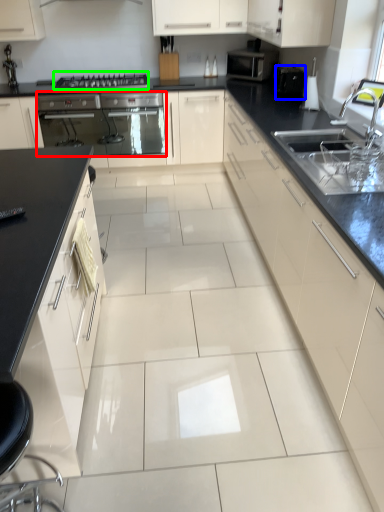
Question: Which object is positioned closest to home appliance (highlighted by a red box)? Select from appliance (highlighted by a blue box) and gas stove (highlighted by a green box).

Choices:
 (A) appliance
 (B) gas stove

Answer: (B)